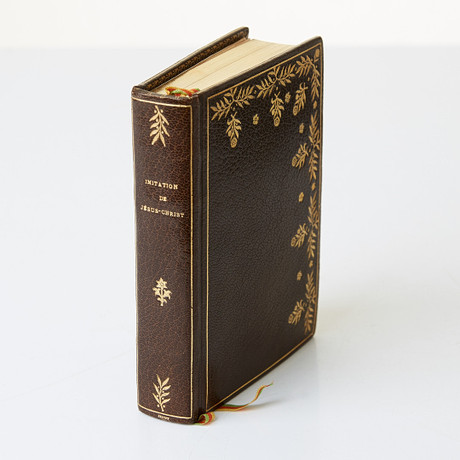
This screenshot has height=460, width=460. I want to click on book marks, so click(x=231, y=405), click(x=207, y=420).